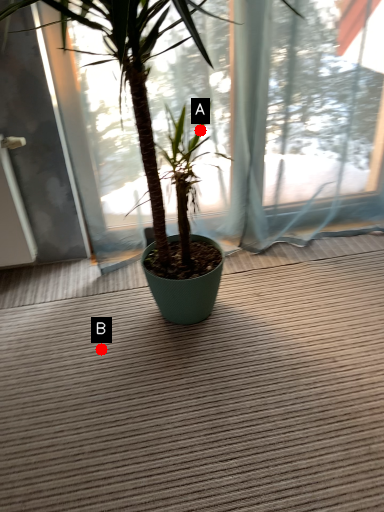
Question: Two points are circled on the image, labeled by A and B beside each circle. Which of the following is the closest to the observer?

Choices:
 (A) A is closer
 (B) B is closer

Answer: (A)